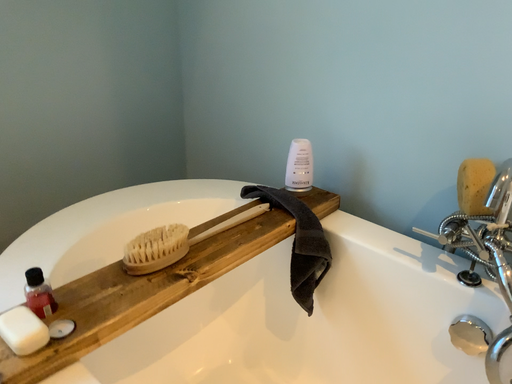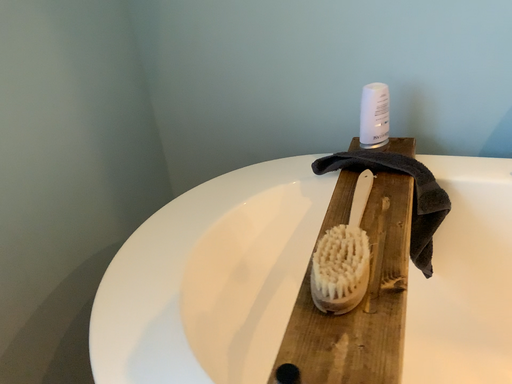
Question: Which way did the camera rotate in the video?

Choices:
 (A) rotated right
 (B) rotated left

Answer: (A)